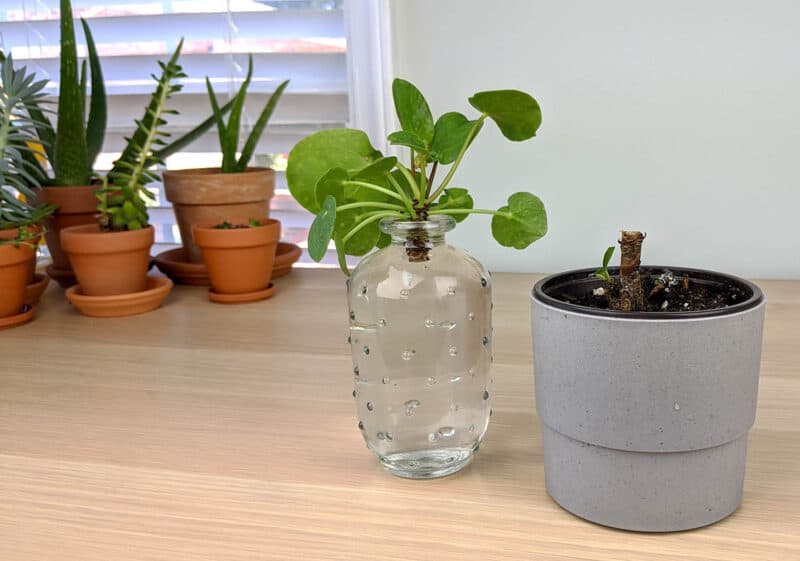
The image size is (800, 561). I want to click on vase, so click(457, 367).